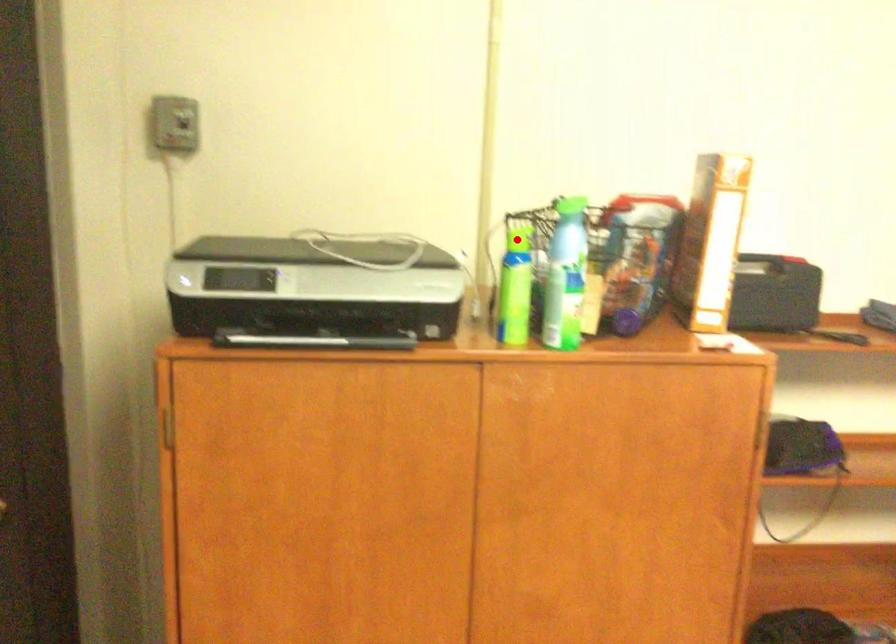
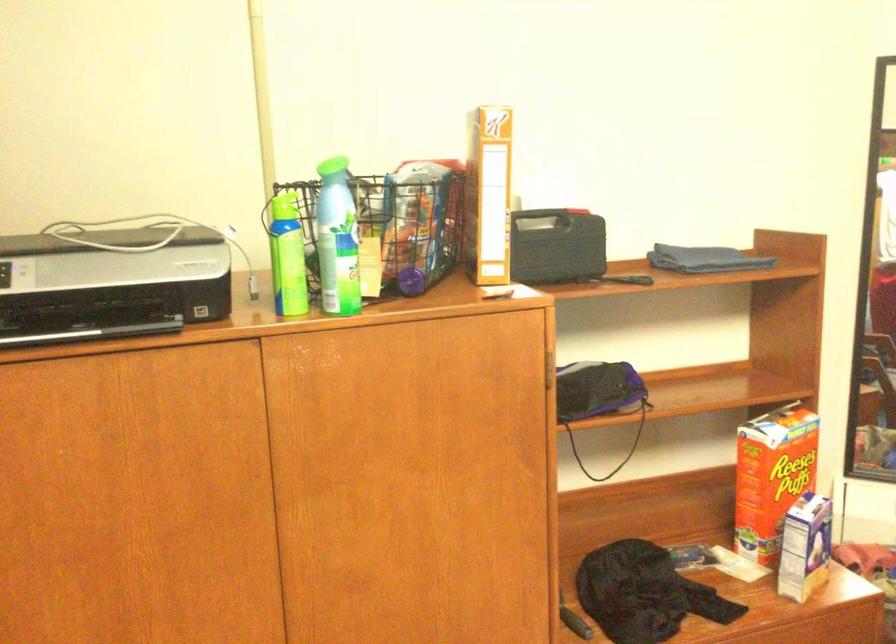
In the second image, find the point that corresponds to the highlighted location in the first image.

(285, 205)